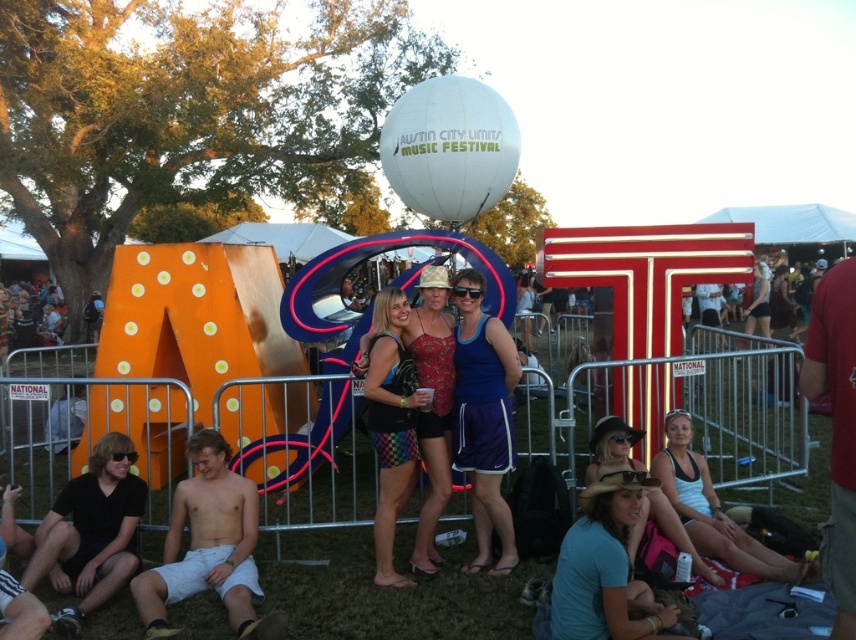
Looking at this image, does blue fabric skirt at center appear under white tank top at lower right?

No.

Can you confirm if blue fabric skirt at center is positioned above white tank top at lower right?

Correct, blue fabric skirt at center is located above white tank top at lower right.

I want to click on blue fabric skirt at center, so click(484, 419).

Which is above, white cotton shorts at lower left or blue fabric skirt at center?

blue fabric skirt at center

How far apart are white cotton shorts at lower left and blue fabric skirt at center?

white cotton shorts at lower left and blue fabric skirt at center are 1.62 meters apart from each other.

Is point (214, 438) positioned after point (486, 547)?

No.

At what (x,y) coordinates should I click in order to perform the action: click on white cotton shorts at lower left. Please return your answer as a coordinate pair (x, y). Looking at the image, I should click on (209, 547).

Who is taller, blue cotton shirt at lower right or rainbow checkered shorts at center?

rainbow checkered shorts at center

Can you confirm if blue cotton shirt at lower right is bigger than rainbow checkered shorts at center?

Incorrect, blue cotton shirt at lower right is not larger than rainbow checkered shorts at center.

Is point (551, 618) closer to viewer compared to point (379, 536)?

That is True.

Locate an element on the screen. This screenshot has width=856, height=640. blue cotton shirt at lower right is located at coordinates (605, 566).